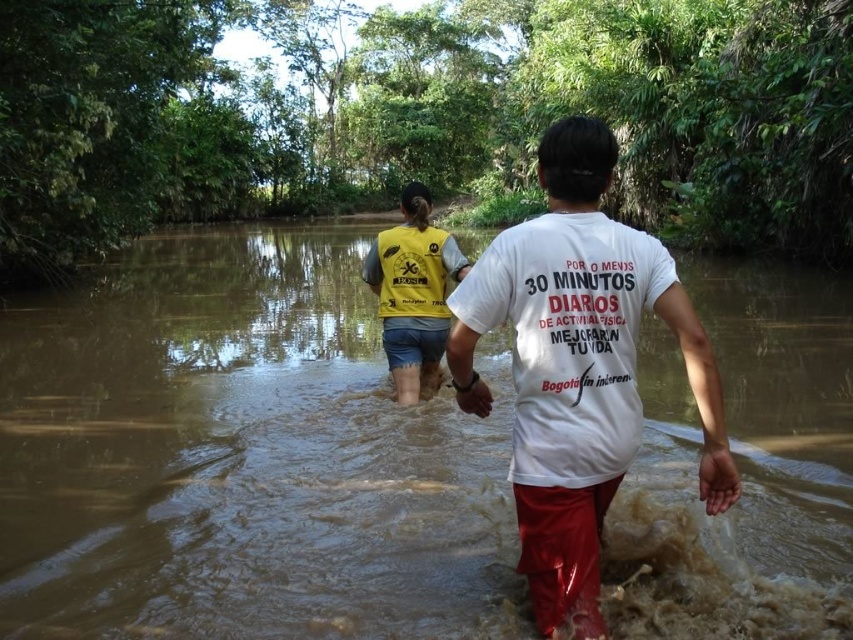
Does brown muddy water at center lie in front of white matte t-shirt at center?

No, brown muddy water at center is behind white matte t-shirt at center.

Is point (33, 515) less distant than point (625, 291)?

No.

Between point (357, 586) and point (506, 230), which one is positioned behind?

Point (357, 586)

The height and width of the screenshot is (640, 853). I want to click on brown muddy water at center, so click(236, 452).

Can you confirm if brown muddy water at center is shorter than yellow fabric vest at center?

In fact, brown muddy water at center may be taller than yellow fabric vest at center.

Does point (445, 419) come farther from viewer compared to point (379, 240)?

Yes, it is.

The image size is (853, 640). Find the location of `brown muddy water at center`. brown muddy water at center is located at coordinates (236, 452).

Which is below, white matte t-shirt at center or yellow fabric vest at center?

white matte t-shirt at center is below.

Does white matte t-shirt at center have a smaller size compared to yellow fabric vest at center?

Actually, white matte t-shirt at center might be larger than yellow fabric vest at center.

Is point (590, 184) less distant than point (410, 269)?

Yes, point (590, 184) is closer to viewer.

This screenshot has width=853, height=640. I want to click on white matte t-shirt at center, so click(x=578, y=369).